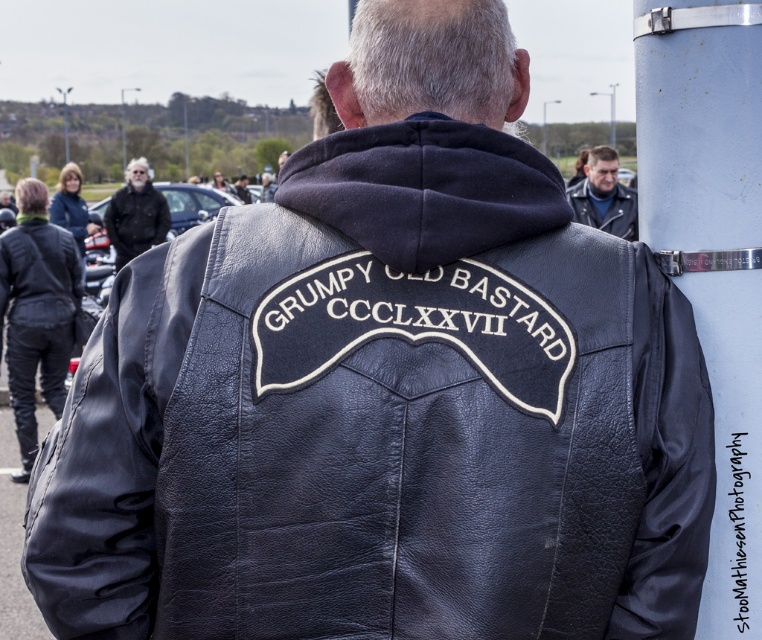
You are a fashion designer observing two leather jackets in the image. The black leather jacket at left and the leather jacket at upper center. Which one is closer to the bottom of the image?

The black leather jacket at left is positioned under the leather jacket at upper center, so it is closer to the bottom of the image.

You are a fashion designer observing the image. You need to determine the spatial relationship between the black leather jacket at center and the gray hair at upper left. Which object is positioned higher in the image?

The gray hair at upper left is positioned higher in the image than the black leather jacket at center.

You are a fashion designer observing the scene. You need to determine which black leather jacket between the black leather jacket at left and the black leather jacket at upper left is taller. Which one is taller?

The black leather jacket at left is much taller than the black leather jacket at upper left.